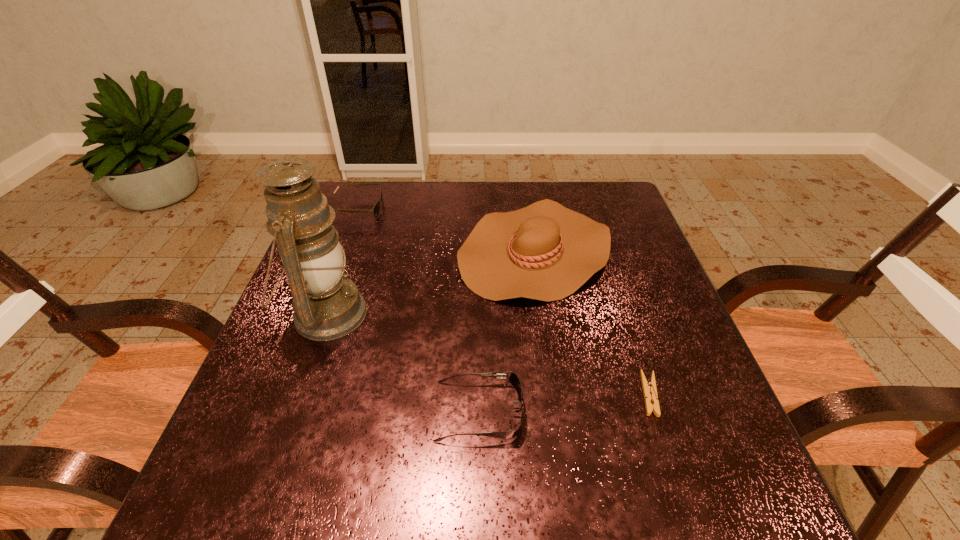
The width and height of the screenshot is (960, 540). Find the location of `blank space at the near edge`. blank space at the near edge is located at coordinates (556, 522).

Identify the location of vacant position at the left edge of the desktop. (292, 411).

Identify the location of vacant space at the right edge of the desktop. click(x=604, y=280).

At what (x,y) coordinates should I click in order to perform the action: click on vacant space at the far left corner of the desktop. Please return your answer as a coordinate pair (x, y). Looking at the image, I should click on (332, 206).

Locate an element on the screen. vacant region at the far right corner of the desktop is located at coordinates coord(583,184).

At what (x,y) coordinates should I click in order to perform the action: click on vacant space at the near right corner of the desktop. Please return your answer as a coordinate pair (x, y). This screenshot has width=960, height=540. Looking at the image, I should click on (727, 510).

At what (x,y) coordinates should I click in order to perform the action: click on free space between the cowboy hat and the left sunglasses. Please return your answer as a coordinate pair (x, y). Looking at the image, I should click on (445, 230).

Locate an element on the screen. free area in between the tallest object and the second tallest object is located at coordinates (431, 282).

Identify the location of blank region between the shortest object and the fourth shortest object. (592, 322).

Where is `free space that is in between the clothespin and the farther sunglasses`? The image size is (960, 540). free space that is in between the clothespin and the farther sunglasses is located at coordinates (503, 301).